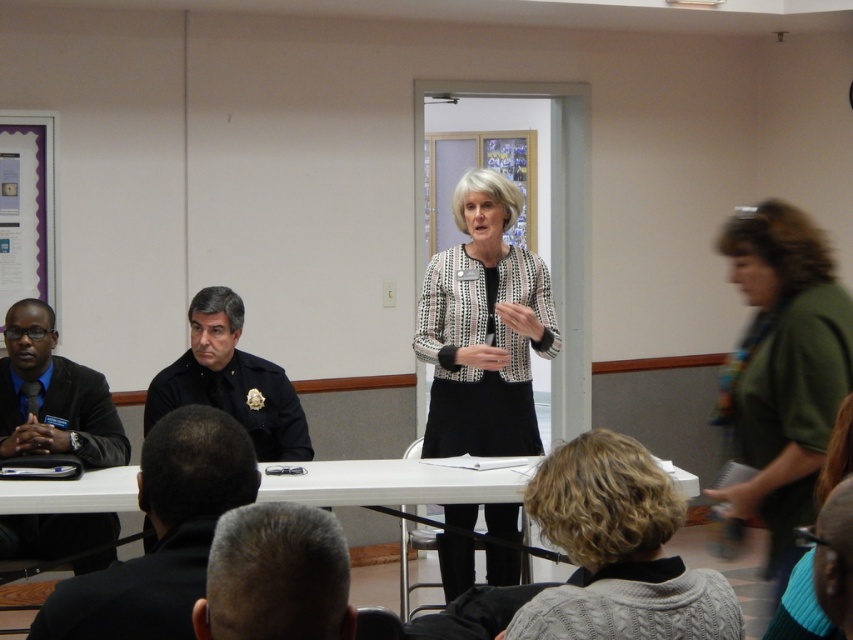
Looking at this image, you are sitting at the back of the room and want to see which point is closer to you. Which point is nearer to your position between point (360, 460) and point (259, 380)?

Point (259, 380) is closer to you because it is nearer to the camera compared to point (360, 460).

You are sitting at the white plastic table at center and want to hand a document to the person wearing the green fabric jacket at right. Which direction should you move to reach them?

The green fabric jacket at right is to the right of the white plastic table at center, so you should move to your right to reach them.

You are organizing a small event and need to know if the green fabric jacket at right can fit on the white plastic table at center. Based on the scene description, can it physically fit?

The green fabric jacket at right has a width less than the white plastic table at center, so it can fit on the table.